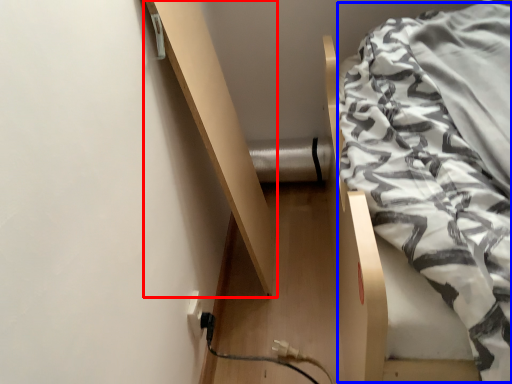
Question: Which point is closer to the camera, shelf (highlighted by a red box) or blanket (highlighted by a blue box)?

Choices:
 (A) shelf
 (B) blanket

Answer: (B)